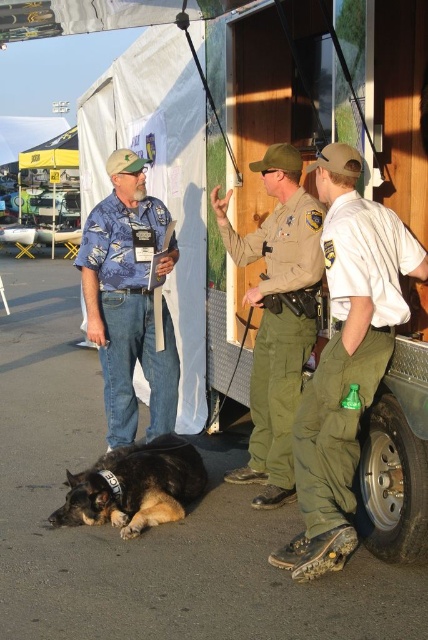
Question: Does black fur dog at lower left appear on the left side of metallic silver tire at lower right?

Choices:
 (A) yes
 (B) no

Answer: (A)

Question: Which point appears farthest from the camera in this image?

Choices:
 (A) (362, 480)
 (B) (70, 483)
 (C) (127, 412)
 (D) (255, 460)

Answer: (C)

Question: Which point is closer to the camera taking this photo?

Choices:
 (A) coord(398,557)
 (B) coord(175,456)
 (C) coord(130,196)
 (D) coord(252,465)

Answer: (A)

Question: Does olive green uniform at lower right appear over metallic silver tire at lower right?

Choices:
 (A) no
 (B) yes

Answer: (B)

Question: Does blue floral shirt at center come in front of metallic silver tire at lower right?

Choices:
 (A) yes
 (B) no

Answer: (B)

Question: Among these objects, which one is nearest to the camera?

Choices:
 (A) blue floral shirt at center
 (B) black fur dog at lower left
 (C) green uniform at center

Answer: (B)